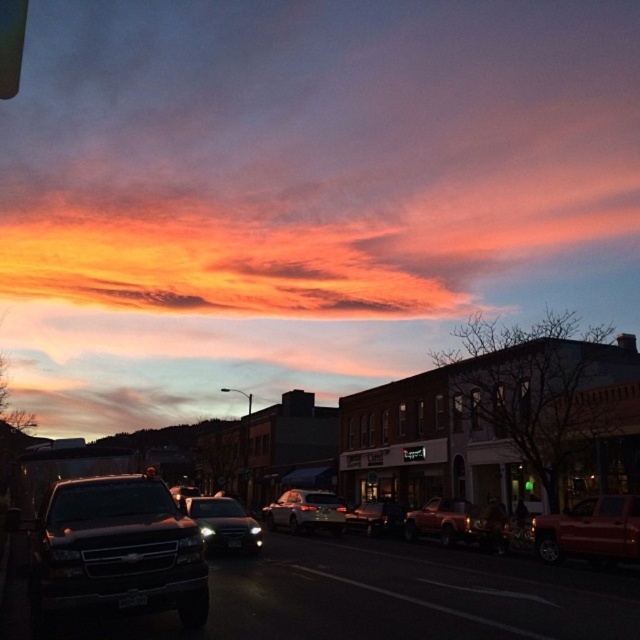
You are standing on the street looking at the sunset scene. There are two points marked in the image, one at coordinates point (145, 499) and another at point (296, 525). Which point is closer to you?

Point (145, 499) is closer to the camera than point (296, 525), so the point at coordinates point (145, 499) is closer to you.

You are a delivery driver who needs to park your satin black sedan at center in a parking spot located at coordinates 0.8, 0.35. Can you safely park there?

The satin black sedan at center is at point (x=225, y=524), which is very close to the parking spot at (x=224, y=512). The slight difference in coordinates suggests it can be parked there safely with minor adjustments.

You are a delivery driver who needs to park your vehicle in this street scene. Your truck is exactly the same size as the shiny black truck at lower left. There is a parking spot next to the satin silver sedan at center that is only wide enough for vehicles narrower than the sedan. Can your truck fit into that parking spot?

The shiny black truck at lower left is narrower than the satin silver sedan at center. Since the parking spot is only wide enough for vehicles narrower than the sedan, your truck, being the same size as the shiny black truck, can fit into the parking spot.